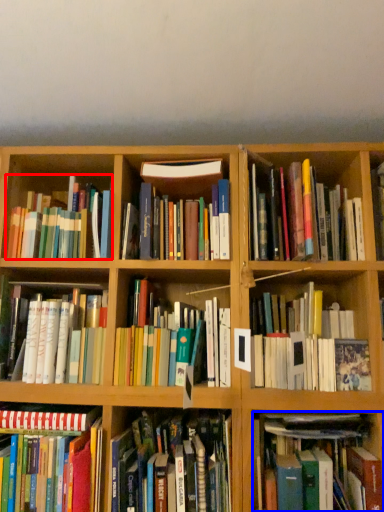
Question: Which of the following is the farthest to the observer, book (highlighted by a red box) or book (highlighted by a blue box)?

Choices:
 (A) book
 (B) book

Answer: (A)